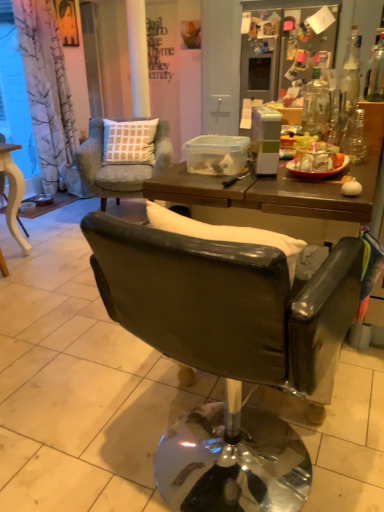
Question: Based on their sizes in the image, would you say matte yellow wooden table at left, the 1th chair viewed from the left, is bigger or smaller than clear glass bottle at upper right, the 3th bottle from the right?

Choices:
 (A) big
 (B) small

Answer: (A)

Question: Is matte yellow wooden table at left, which ranks as the 3th chair in right-to-left order, spatially inside clear glass bottle at upper right, the 3th bottle from the right, or outside of it?

Choices:
 (A) outside
 (B) inside

Answer: (A)

Question: Based on their relative distances, which object is nearer to the matte yellow wooden table at left, which ranks as the 3th chair in right-to-left order?

Choices:
 (A) transparent glass bottle at right, the second bottle from the left
 (B) matte black portrait at upper left
 (C) brown wooden table at center
 (D) clear glass bottle at upper right, the 1th bottle positioned from the left
 (E) leather-like black chair at center, the 1th chair positioned from the right

Answer: (B)

Question: Estimate the real-world distances between objects in this image. Which object is closer to the clear glass bottle at upper right, the 3th bottle from the right?

Choices:
 (A) brown wooden table at center
 (B) matte yellow wooden table at left, arranged as the 2th chair when viewed from the front
 (C) transparent glass bottle at upper right, the 1th bottle viewed from the right
 (D) leather-like black chair at center, which is the third chair in back-to-front order
 (E) matte black portrait at upper left

Answer: (A)